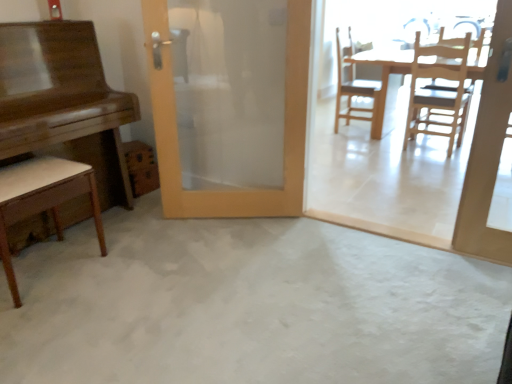
This screenshot has width=512, height=384. In order to click on vacant region to the left of wooden chair at right, placed as the 2th chair when sorted from front to back in this screenshot , I will do `click(377, 154)`.